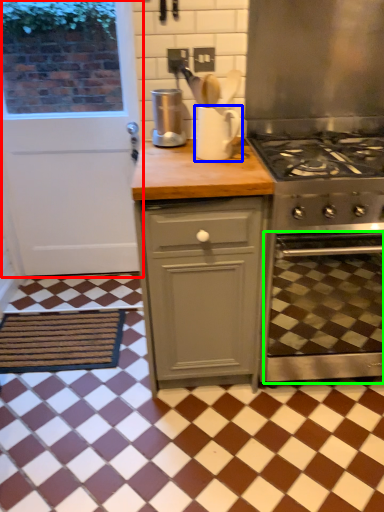
Question: Which is farther away from door (highlighted by a red box)? appliance (highlighted by a blue box) or oven (highlighted by a green box)?

Choices:
 (A) appliance
 (B) oven

Answer: (B)